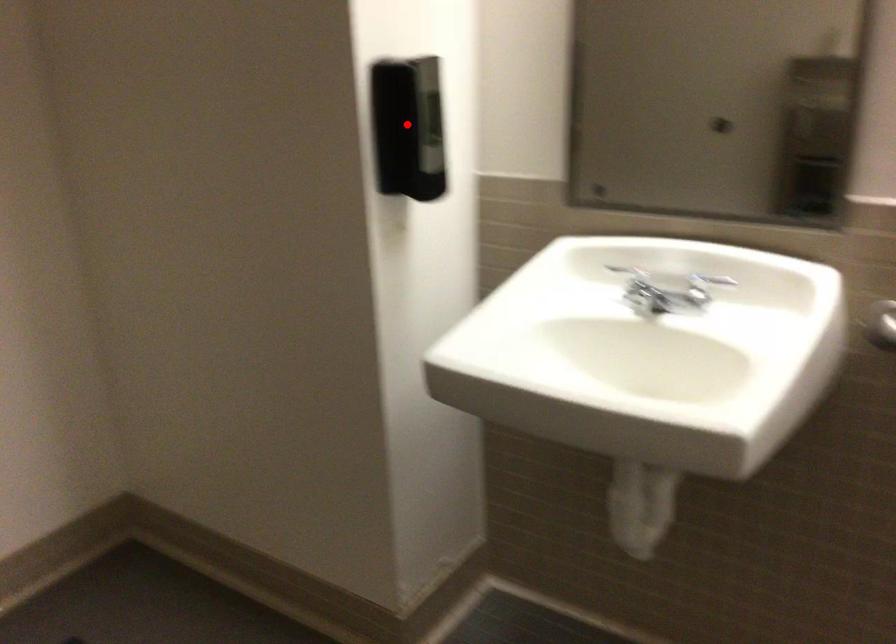
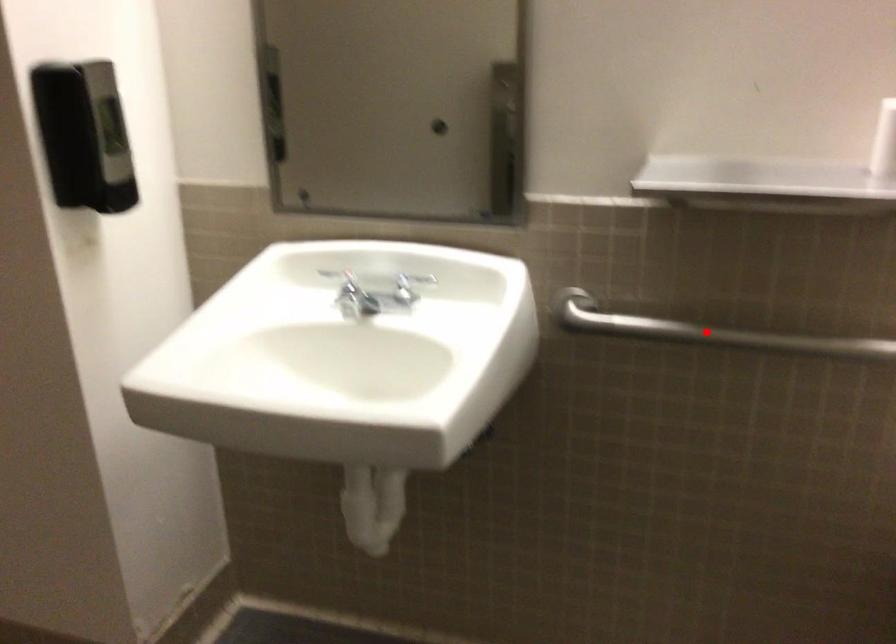
Consider the image. I am providing you with two images of the same scene from different viewpoints. A red point is marked on the first image and another point is marked on the second image. Is the red point in image1 aligned with the point shown in image2?

No